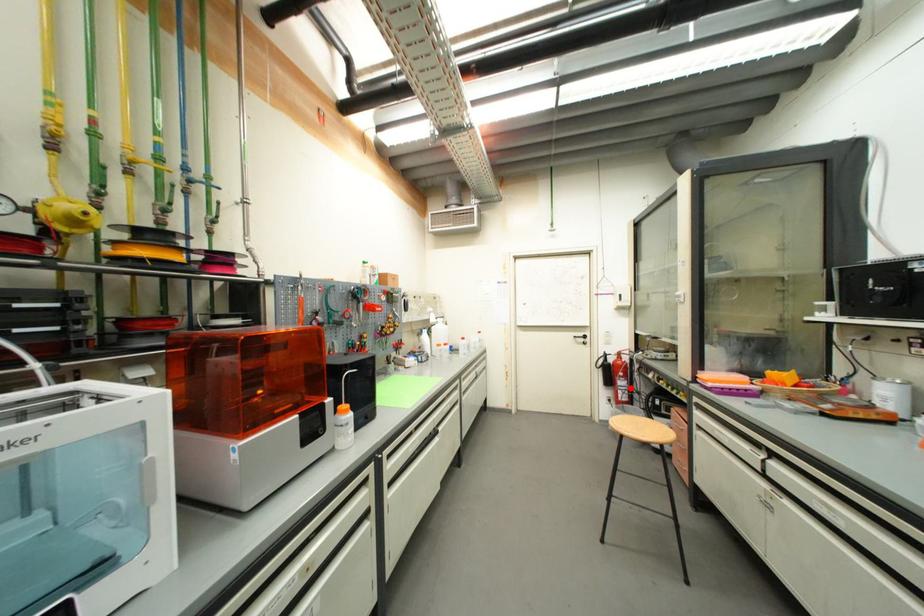
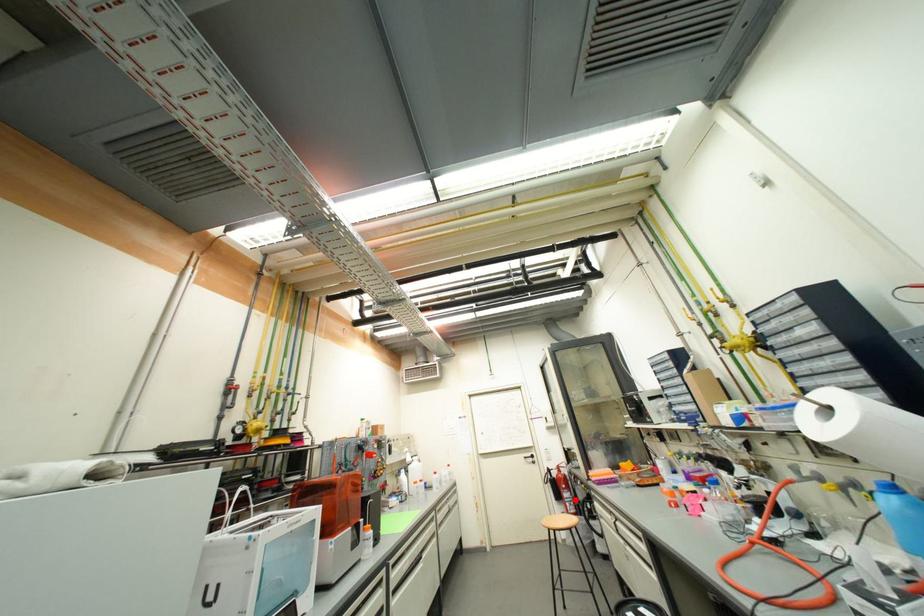
I am providing you with two images of the same scene from different viewpoints. A red point is marked on the first image and another point is marked on the second image. Does the point marked in image1 correspond to the same location as the one in image2?

Yes